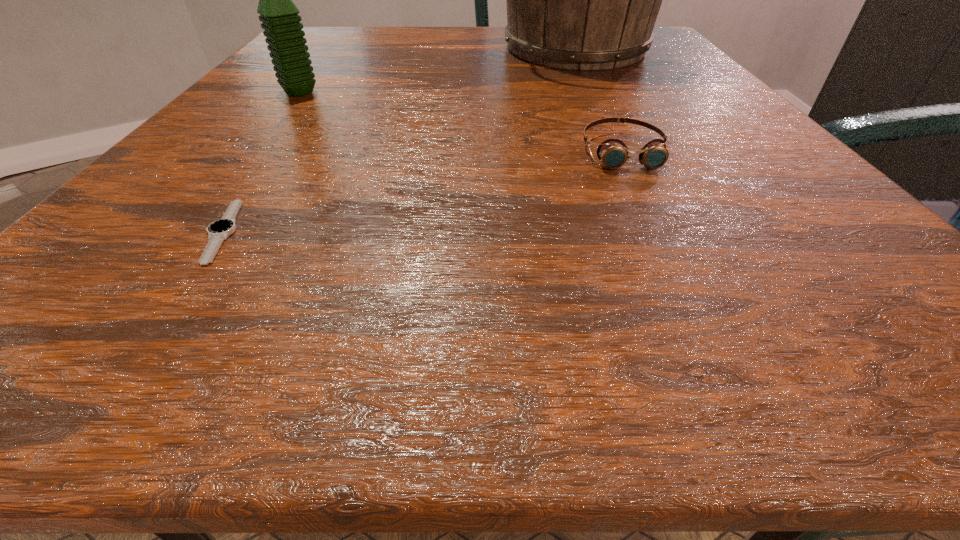
You are a GUI agent. You are given a task and a screenshot of the screen. Output one action in this format:
    pyautogui.click(x=<x>, y=<y>)
    Task: Click on the free location at the left edge of the desktop
    This screenshot has height=540, width=960.
    Given the screenshot: What is the action you would take?
    pyautogui.click(x=170, y=181)

The image size is (960, 540). I want to click on free space at the right edge, so click(732, 259).

The height and width of the screenshot is (540, 960). I want to click on free spot at the far left corner of the desktop, so click(x=324, y=46).

Image resolution: width=960 pixels, height=540 pixels. In the image, there is a desktop. What are the coordinates of `vacant space at the near left corner` in the screenshot? It's located at (115, 349).

Where is `vacant space that's between the watch and the second shortest object`? vacant space that's between the watch and the second shortest object is located at coordinates tap(422, 191).

Identify the location of unoccupied position between the second shortest object and the tallest object. The image size is (960, 540). (599, 100).

Where is `free space between the second shortest object and the bucket`? Image resolution: width=960 pixels, height=540 pixels. free space between the second shortest object and the bucket is located at coordinates (599, 100).

At what (x,y) coordinates should I click in order to perform the action: click on empty location between the water bottle and the nearest object. Please return your answer as a coordinate pair (x, y). Looking at the image, I should click on (261, 161).

You are a GUI agent. You are given a task and a screenshot of the screen. Output one action in this format:
    pyautogui.click(x=<x>, y=<y>)
    Task: Click on the unoccupied position between the second tallest object and the watch
    
    Given the screenshot: What is the action you would take?
    pyautogui.click(x=261, y=161)

Find the location of a particular element. vacant region between the water bottle and the watch is located at coordinates (261, 161).